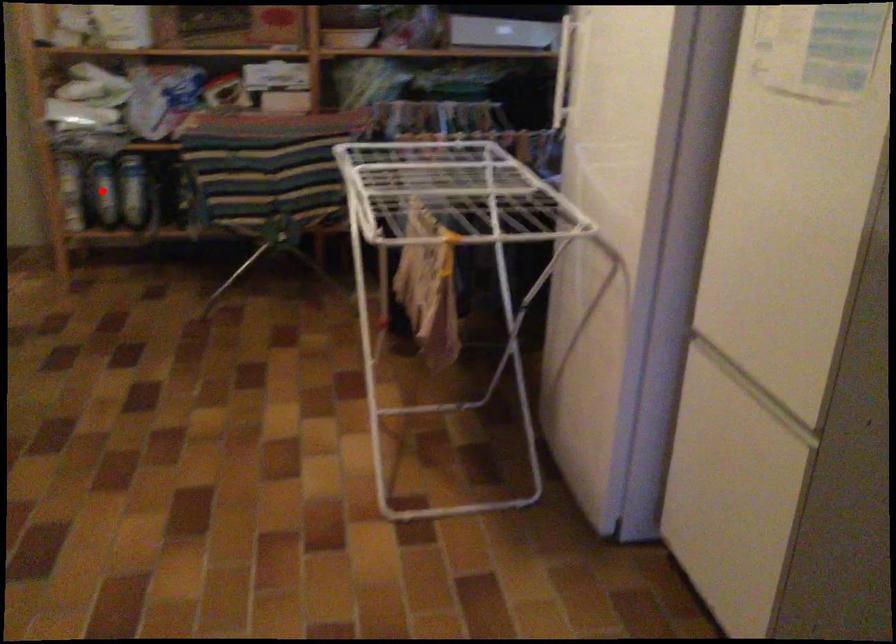
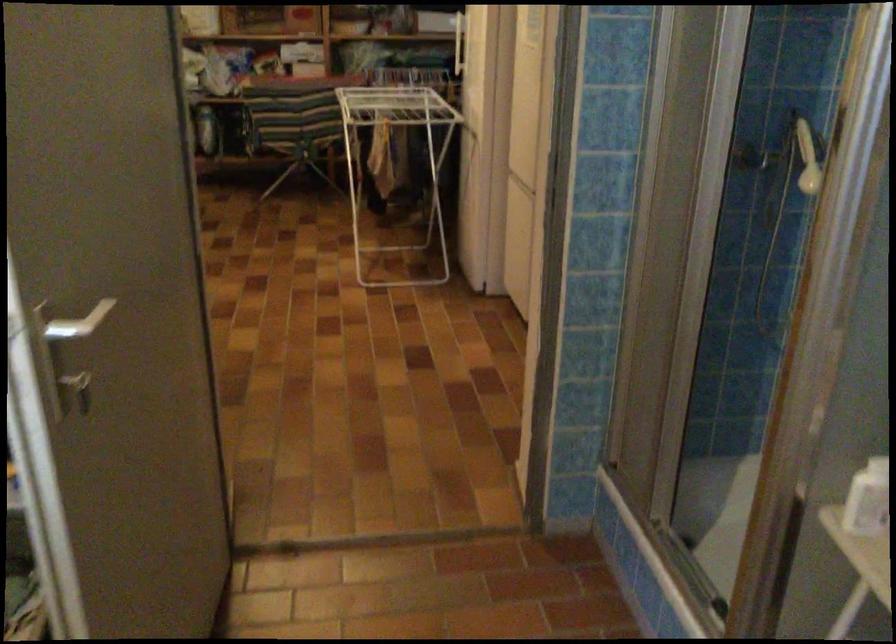
Question: I am providing you with two images of the same scene from different viewpoints. A red point is marked on the first image. Is the red point's position out of view in image 2?

Choices:
 (A) Yes
 (B) No

Answer: (A)